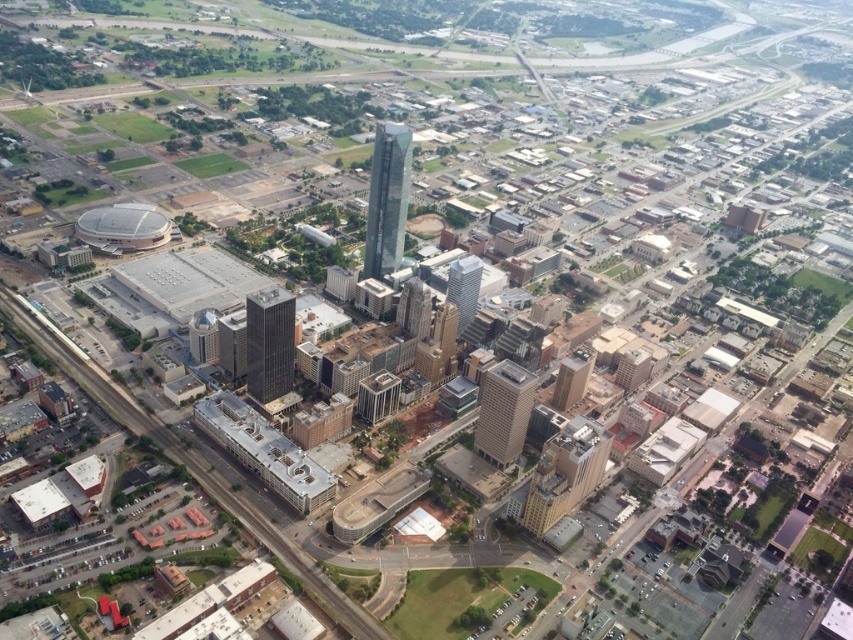
You are a drone operator trying to deliver a package to a location marked by point (x=399, y=189). The drone has a maximum flight range of 600 meters. Based on the cityscape view, can the drone reach the point without running out of battery?

The distance between point (x=399, y=189) and the camera is 617.43 meters, which exceeds the drone operator maximum flight range of 600 meters. Therefore, the drone cannot reach the point without running out of battery.

You are a city planner reviewing this aerial view. You need to determine if the distance between the shiny glass skyscraper at center and the glassy silver skyscraper at center is sufficient to allow a helicopter to land safely between them. The helicopter requires a minimum of 60 meters of clearance. Can the helicopter land between them?

The shiny glass skyscraper at center is 62.94 meters from the glassy silver skyscraper at center. Since the required clearance is 60 meters, the helicopter can safely land between them as the distance meets the minimum requirement.